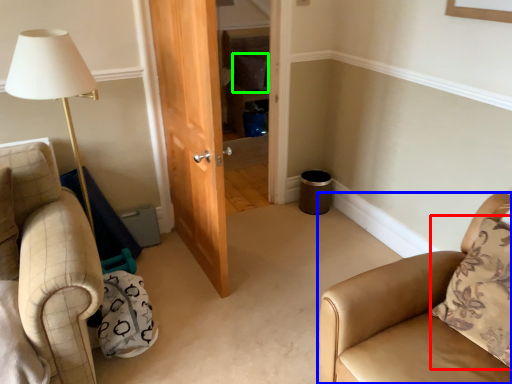
Question: Which object is the farthest from pillow (highlighted by a red box)? Choose among these: chair (highlighted by a blue box) or pillow (highlighted by a green box).

Choices:
 (A) chair
 (B) pillow

Answer: (B)